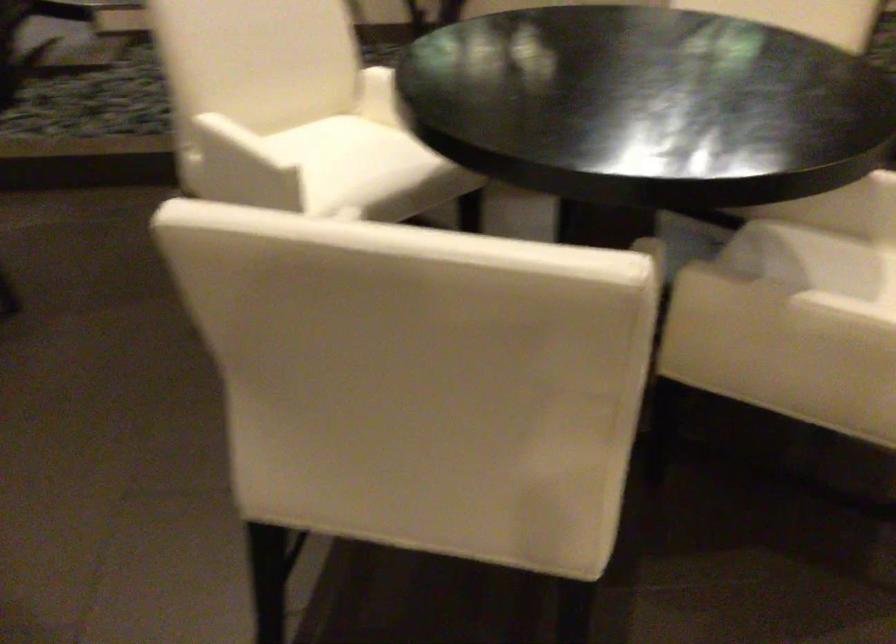
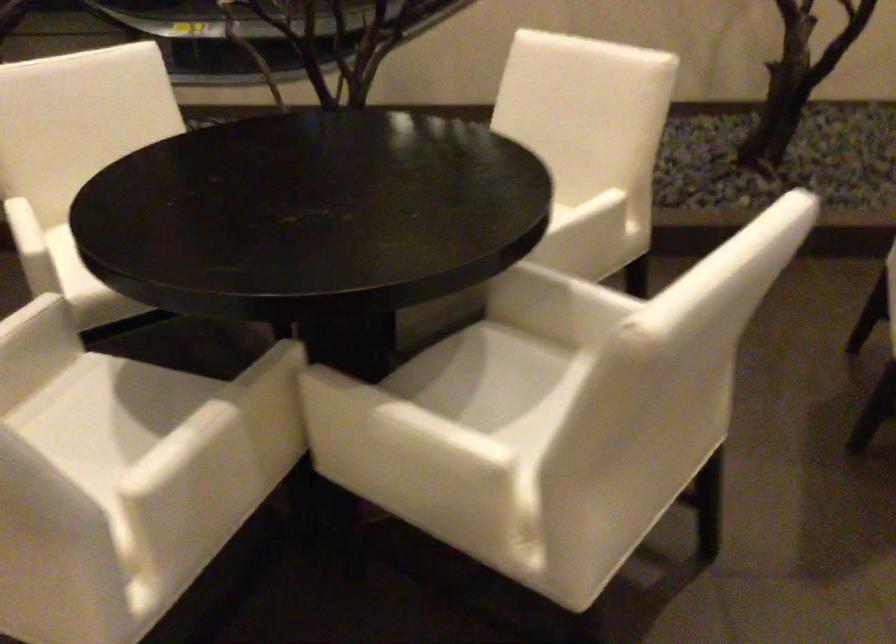
Question: The images are taken continuously from a first-person perspective. In which direction are you moving?

Choices:
 (A) Left
 (B) Right
 (C) Forward
 (D) Backward

Answer: (B)